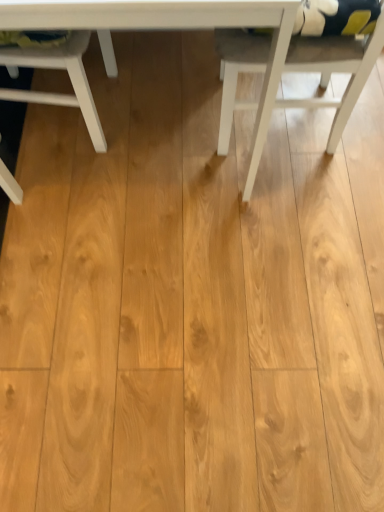
Question: Is white matte chair at right, placed as the 1th chair when sorted from right to left, turned away from white wood table at center?

Choices:
 (A) yes
 (B) no

Answer: (B)

Question: Does white matte chair at right, placed as the 1th chair when sorted from right to left, come in front of white wood table at center?

Choices:
 (A) yes
 (B) no

Answer: (B)

Question: Can you confirm if white matte chair at right, placed as the 1th chair when sorted from right to left, is shorter than white wood table at center?

Choices:
 (A) yes
 (B) no

Answer: (A)

Question: From the image's perspective, is white matte chair at right, which is the second chair in left-to-right order, below white wood table at center?

Choices:
 (A) yes
 (B) no

Answer: (A)

Question: Is white matte chair at right, which is the second chair in left-to-right order, behind white wood table at center?

Choices:
 (A) yes
 (B) no

Answer: (A)

Question: From a real-world perspective, is white matte chair at right, placed as the 1th chair when sorted from right to left, over white wood table at center?

Choices:
 (A) yes
 (B) no

Answer: (B)

Question: Is white matte chair at upper left, positioned as the first chair in left-to-right order, located within white wood table at center?

Choices:
 (A) yes
 (B) no

Answer: (A)

Question: Considering the relative positions of white wood table at center and white matte chair at upper left, arranged as the second chair when viewed from the right, in the image provided, is white wood table at center in front of white matte chair at upper left, arranged as the second chair when viewed from the right,?

Choices:
 (A) no
 (B) yes

Answer: (B)

Question: From a real-world perspective, does white wood table at center sit lower than white matte chair at upper left, arranged as the second chair when viewed from the right?

Choices:
 (A) no
 (B) yes

Answer: (A)

Question: Considering the relative sizes of white wood table at center and white matte chair at upper left, positioned as the first chair in left-to-right order, in the image provided, is white wood table at center smaller than white matte chair at upper left, positioned as the first chair in left-to-right order,?

Choices:
 (A) yes
 (B) no

Answer: (B)

Question: Does white wood table at center have a lesser height compared to white matte chair at upper left, arranged as the second chair when viewed from the right?

Choices:
 (A) yes
 (B) no

Answer: (B)

Question: Is white wood table at center bigger than white matte chair at upper left, positioned as the first chair in left-to-right order?

Choices:
 (A) yes
 (B) no

Answer: (A)

Question: Is white matte chair at upper left, arranged as the second chair when viewed from the right, closer to camera compared to white wood table at center?

Choices:
 (A) no
 (B) yes

Answer: (A)